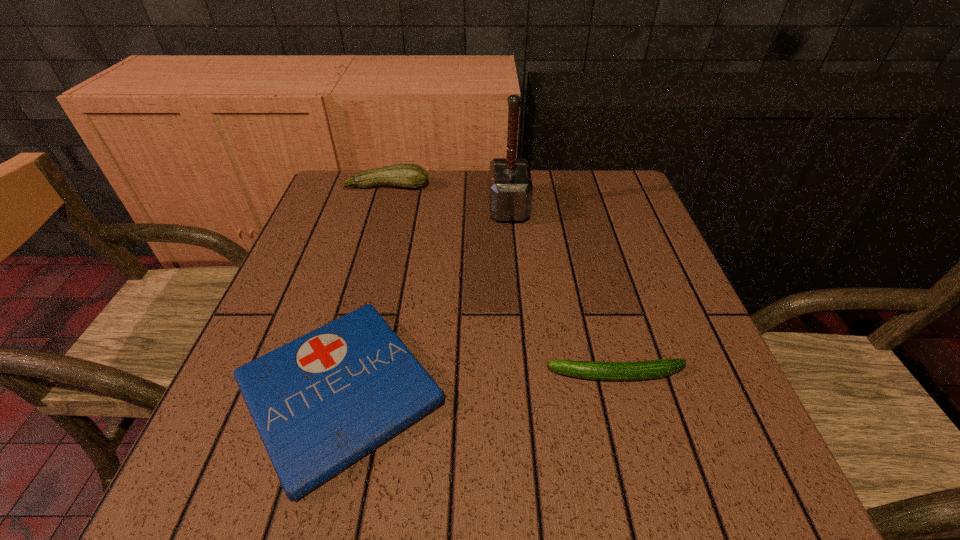
The height and width of the screenshot is (540, 960). Identify the location of vacant region located 0.180m on the front-facing side of the right zucchini. point(441,375).

Identify the location of vacant position located on the right of the first-aid kit. The image size is (960, 540). (641, 392).

Locate an element on the screen. Image resolution: width=960 pixels, height=540 pixels. hammer that is at the far edge is located at coordinates (510, 185).

I want to click on zucchini at the far edge, so click(x=413, y=176).

Locate an element on the screen. This screenshot has height=540, width=960. object at the near edge is located at coordinates (320, 403).

In order to click on zucchini present at the left edge in this screenshot , I will do `click(413, 176)`.

Image resolution: width=960 pixels, height=540 pixels. Identify the location of the first-aid kit at the left edge. (320, 403).

At what (x,y) coordinates should I click in order to perform the action: click on object that is at the right edge. Please return your answer as a coordinate pair (x, y). Image resolution: width=960 pixels, height=540 pixels. Looking at the image, I should click on (642, 370).

The image size is (960, 540). Find the location of `object that is at the far left corner`. object that is at the far left corner is located at coordinates (413, 176).

Identify the location of object located in the near left corner section of the desktop. (320, 403).